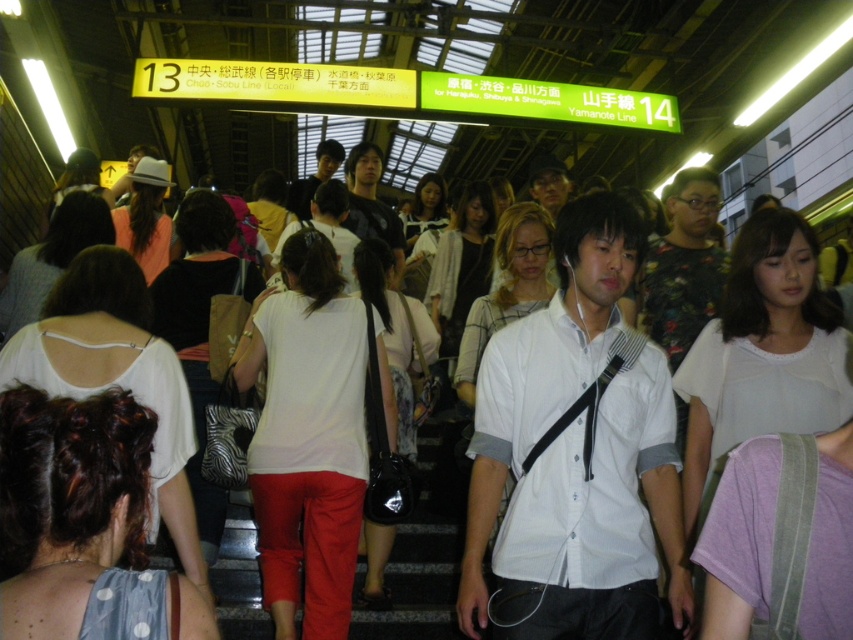
Can you confirm if matte black bag at center is taller than white knit cardigan at center?

Indeed, matte black bag at center has a greater height compared to white knit cardigan at center.

Does matte black bag at center have a lesser width compared to white knit cardigan at center?

Yes.

Is point (410, 417) positioned before point (469, 264)?

Yes.

Locate an element on the screen. matte black bag at center is located at coordinates (397, 333).

Can you confirm if white matte shirt at center is smaller than matte black bag at center?

Actually, white matte shirt at center might be larger than matte black bag at center.

Who is lower down, white matte shirt at center or matte black bag at center?

Positioned lower is white matte shirt at center.

Image resolution: width=853 pixels, height=640 pixels. What do you see at coordinates (306, 436) in the screenshot?
I see `white matte shirt at center` at bounding box center [306, 436].

Find the location of a particular element. This screenshot has height=640, width=853. white matte shirt at center is located at coordinates (306, 436).

This screenshot has height=640, width=853. Describe the element at coordinates (306, 436) in the screenshot. I see `white matte shirt at center` at that location.

Based on the photo, is white matte shirt at center positioned at the back of dark brown hair at center?

Yes, white matte shirt at center is behind dark brown hair at center.

What do you see at coordinates (306, 436) in the screenshot?
I see `white matte shirt at center` at bounding box center [306, 436].

I want to click on white matte shirt at center, so click(x=306, y=436).